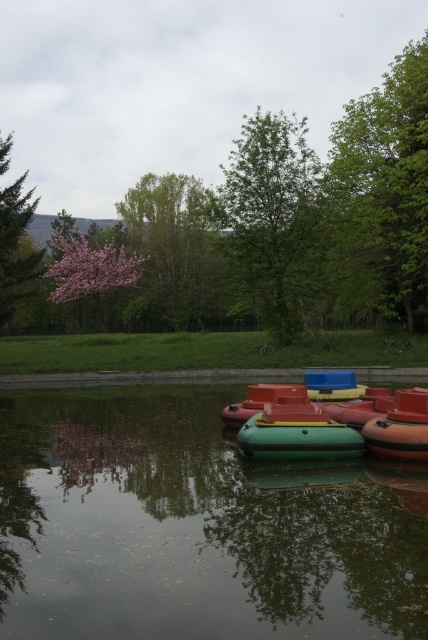
Can you confirm if green leafy tree at center is positioned below green matte tree at left?

Actually, green leafy tree at center is above green matte tree at left.

Does green leafy tree at center appear on the left side of green matte tree at left?

In fact, green leafy tree at center is to the right of green matte tree at left.

Where is `green leafy tree at center`? The width and height of the screenshot is (428, 640). green leafy tree at center is located at coordinates (273, 218).

Locate an element on the screen. The height and width of the screenshot is (640, 428). green leafy tree at center is located at coordinates click(x=273, y=218).

Can you confirm if green leafy tree at upper right is positioned below pink blossoms at upper left?

No, green leafy tree at upper right is not below pink blossoms at upper left.

You are a GUI agent. You are given a task and a screenshot of the screen. Output one action in this format:
    pyautogui.click(x=<x>, y=<y>)
    Task: Click on the green leafy tree at upper right
    The image size is (428, 640).
    Given the screenshot: What is the action you would take?
    pyautogui.click(x=383, y=193)

Who is more distant from viewer, (397, 83) or (169, 292)?

Point (169, 292)

The height and width of the screenshot is (640, 428). Find the location of `green leafy tree at upper right`. green leafy tree at upper right is located at coordinates (383, 193).

Based on the photo, which is more to the right, green rubber boats at lower center or green matte tree at left?

green rubber boats at lower center

Is point (264, 499) in front of point (30, 284)?

That is True.

The height and width of the screenshot is (640, 428). I want to click on green rubber boats at lower center, so click(195, 528).